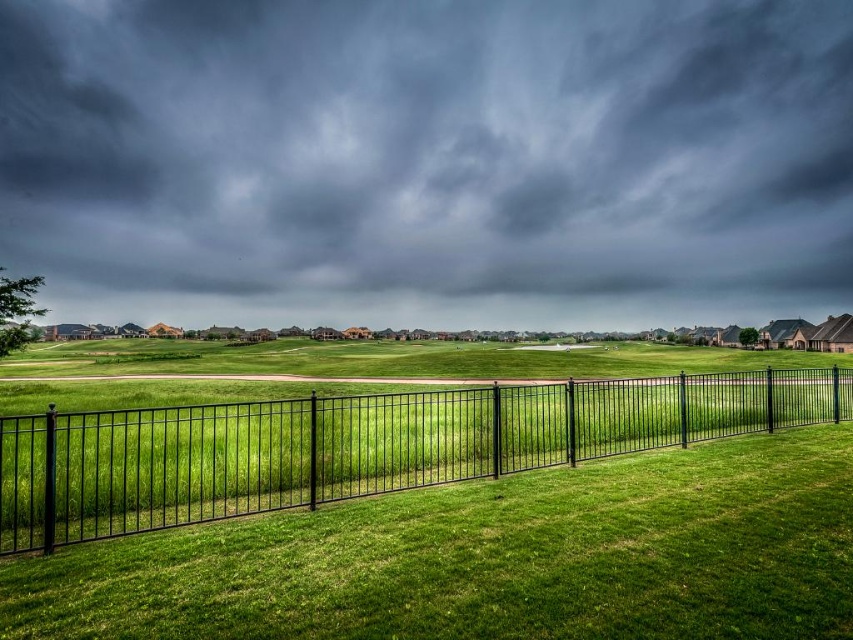
From the picture: You are standing in the suburban landscape and want to take a photo of the dark gray cloud at upper center and the black metal fence at center. Which object should you point your camera towards first to capture both in the same frame?

You should point your camera towards the dark gray cloud at upper center first because it is to the left of the black metal fence at center, so capturing it first ensures both are in the frame.

You are a drone operator who needs to fly a drone from the black metal fence at center to the dark gray cloud at upper center. Given that your drone has a maximum flight range of 500 feet, will it be able to reach the cloud without needing a recharge?

The distance between the dark gray cloud at upper center and the black metal fence at center is 469.38 feet, which is within the drone operator s drone maximum flight range of 500 feet. The drone can reach the dark gray cloud at upper center without needing a recharge.

You are a drone operator planning to fly your drone over the suburban landscape shown. Your drone has a maximum flight altitude of 100 meters. Considering the dark gray cloud at upper center and the black metal fence at center, which object is closer to the drone when it reaches its maximum altitude?

The black metal fence at center is behind the dark gray cloud at upper center, so the dark gray cloud at upper center is closer to the drone when it reaches its maximum altitude of 100 meters.